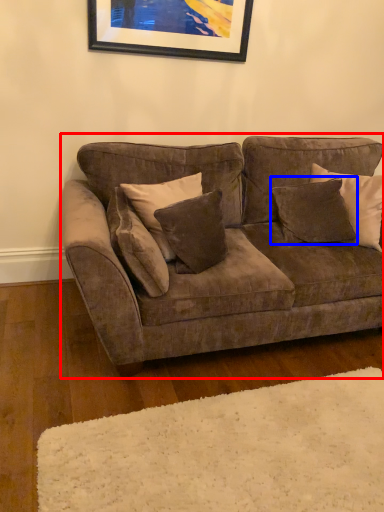
Question: Which object appears farthest to the camera in this image, studio couch (highlighted by a red box) or pillow (highlighted by a blue box)?

Choices:
 (A) studio couch
 (B) pillow

Answer: (B)